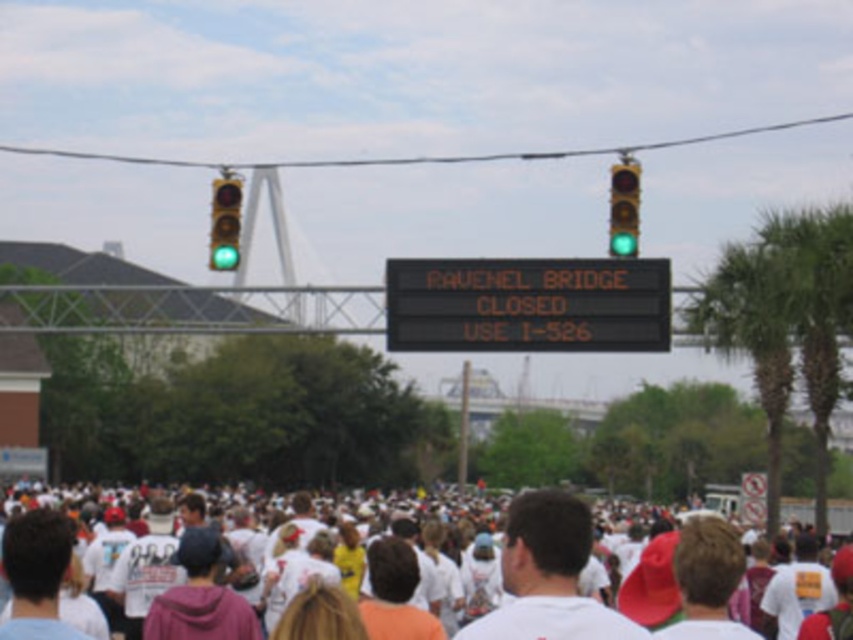
You are a pedestrian trying to cross the street. You see the white cotton crowd at lower center and the green glass traffic light at left. Which one is nearer to you?

The white cotton crowd at lower center is closer to the viewer than the green glass traffic light at left, so the white cotton crowd at lower center is nearer.

You are a drone operator trying to capture aerial footage of the event. The white cotton crowd at lower center and the black electronic scoreboard at center are both in your camera view. Which object will appear larger in the footage?

The white cotton crowd at lower center will appear larger in the footage because it is taller than the black electronic scoreboard at center.

You are a photographer trying to capture the entire scene of the white cotton crowd at lower center and the green glass traffic light at upper center in a single photo. Based on their sizes in the image, which object would appear bigger in your photo?

The white cotton crowd at lower center would appear bigger in the photo because it is larger in size than the green glass traffic light at upper center according to the description.